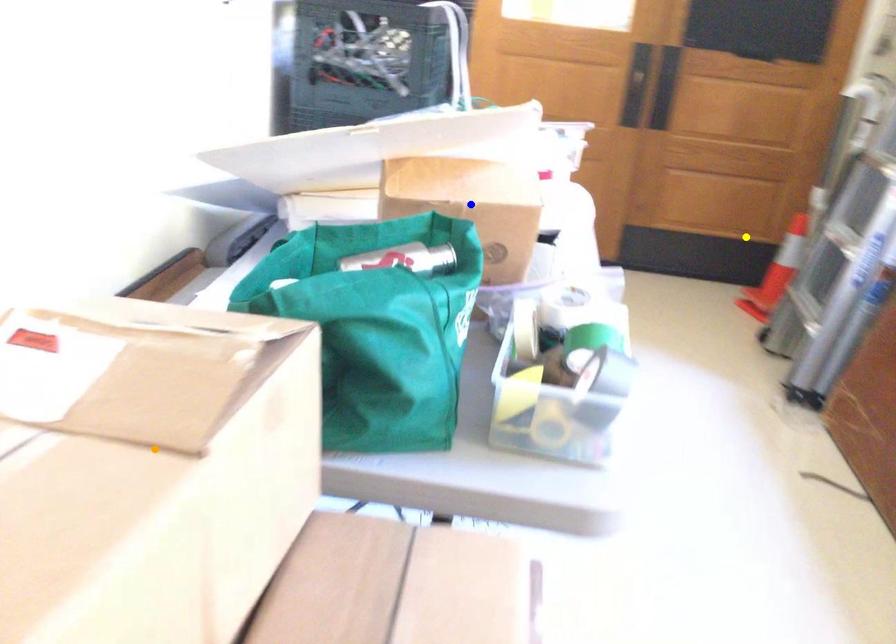
Order these from nearest to farthest:
1. orange point
2. yellow point
3. blue point

orange point
blue point
yellow point